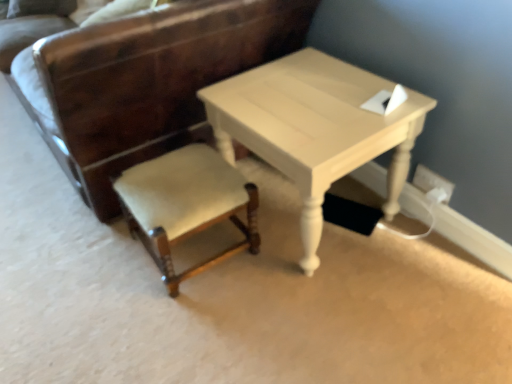
This screenshot has height=384, width=512. Find the location of `vacant region under velvet beige stool at center, the 2th chair in the top-to-bottom sequence (from a real-world perspective)`. vacant region under velvet beige stool at center, the 2th chair in the top-to-bottom sequence (from a real-world perspective) is located at coordinates (203, 261).